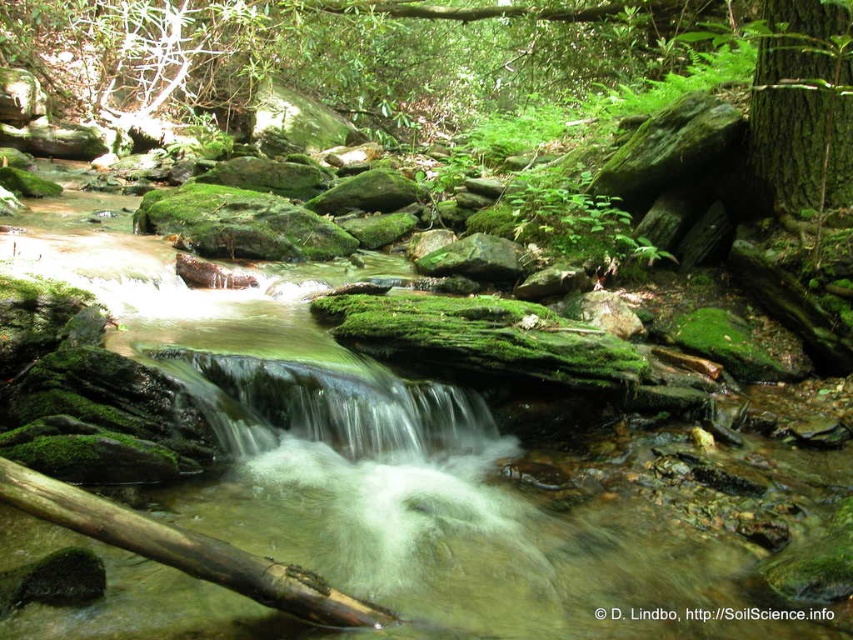
Who is positioned more to the left, green rough bark tree at upper right or brown rough log at lower center?

From the viewer's perspective, brown rough log at lower center appears more on the left side.

Is point (842, 56) positioned after point (223, 573)?

Yes.

Between point (804, 202) and point (372, 620), which one is positioned in front?

Positioned in front is point (372, 620).

Find the location of `green rough bark tree at upper right`. green rough bark tree at upper right is located at coordinates (802, 106).